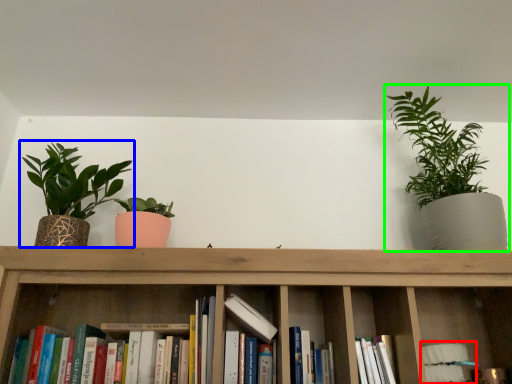
Question: Which is farther away from book (highlighted by a red box)? houseplant (highlighted by a blue box) or houseplant (highlighted by a green box)?

Choices:
 (A) houseplant
 (B) houseplant

Answer: (A)